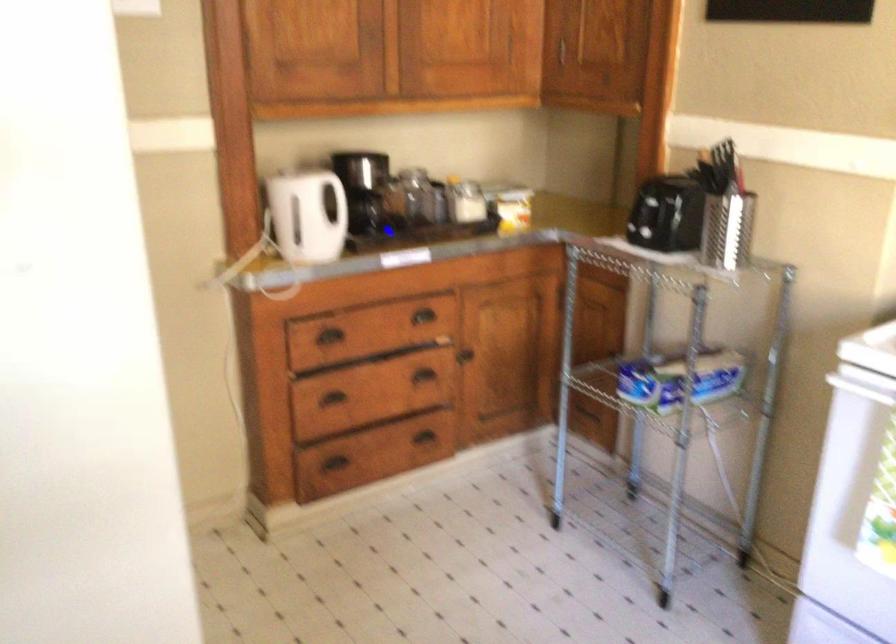
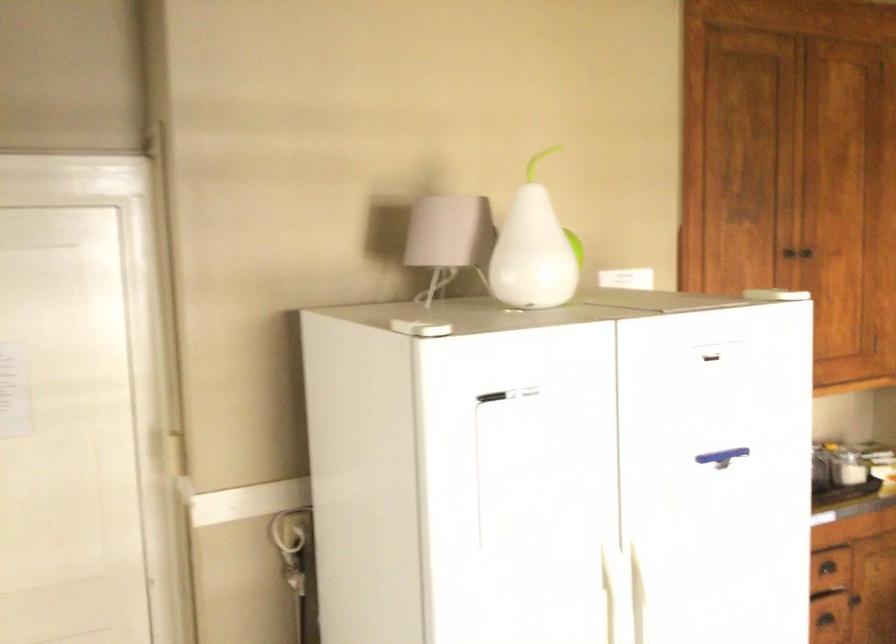
The point at (416, 348) is marked in the first image. Where is the corresponding point in the second image?

(824, 619)